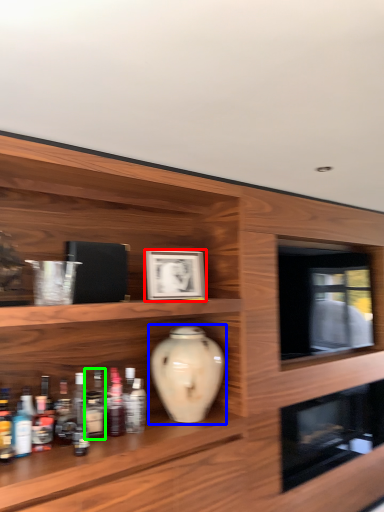
Question: Considering the real-world distances, which object is closest to picture frame (highlighted by a red box)? vase (highlighted by a blue box) or bottle (highlighted by a green box).

Choices:
 (A) vase
 (B) bottle

Answer: (A)